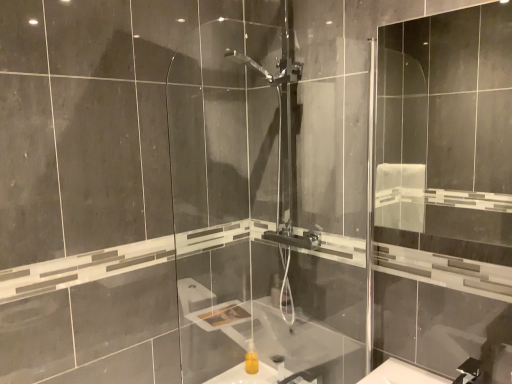
Question: Should I look upward or downward to see transparent glass shower door at center, the 1th screen door from the left?

Choices:
 (A) up
 (B) down

Answer: (B)

Question: Does transparent glass shower door at center, the 1th screen door from the left, have a lesser height compared to transparent glass screen door at right, positioned as the second screen door in left-to-right order?

Choices:
 (A) no
 (B) yes

Answer: (A)

Question: Is transparent glass shower door at center, which is the 2th screen door in right-to-left order, touching transparent glass screen door at right, the first screen door positioned from the right?

Choices:
 (A) yes
 (B) no

Answer: (B)

Question: From the image's perspective, is transparent glass shower door at center, which is the 2th screen door in right-to-left order, under transparent glass screen door at right, positioned as the second screen door in left-to-right order?

Choices:
 (A) yes
 (B) no

Answer: (A)

Question: Is transparent glass shower door at center, the 1th screen door from the left, wider than transparent glass screen door at right, positioned as the second screen door in left-to-right order?

Choices:
 (A) no
 (B) yes

Answer: (A)

Question: Can you confirm if transparent glass shower door at center, the 1th screen door from the left, is bigger than transparent glass screen door at right, positioned as the second screen door in left-to-right order?

Choices:
 (A) no
 (B) yes

Answer: (B)

Question: Is transparent glass screen door at right, positioned as the second screen door in left-to-right order, surrounded by transparent glass shower door at center, which is the 2th screen door in right-to-left order?

Choices:
 (A) no
 (B) yes

Answer: (A)

Question: Can you confirm if transparent glass screen door at right, the first screen door positioned from the right, is taller than yellow matte sink at center?

Choices:
 (A) yes
 (B) no

Answer: (A)

Question: Is transparent glass screen door at right, positioned as the second screen door in left-to-right order, to the right of yellow matte sink at center from the viewer's perspective?

Choices:
 (A) no
 (B) yes

Answer: (B)

Question: Considering the relative sizes of transparent glass screen door at right, the first screen door positioned from the right, and yellow matte sink at center in the image provided, is transparent glass screen door at right, the first screen door positioned from the right, smaller than yellow matte sink at center?

Choices:
 (A) no
 (B) yes

Answer: (A)

Question: From a real-world perspective, does transparent glass screen door at right, the first screen door positioned from the right, sit lower than yellow matte sink at center?

Choices:
 (A) no
 (B) yes

Answer: (A)

Question: Is transparent glass screen door at right, the first screen door positioned from the right, to the left of yellow matte sink at center from the viewer's perspective?

Choices:
 (A) yes
 (B) no

Answer: (B)

Question: Are transparent glass screen door at right, the first screen door positioned from the right, and yellow matte sink at center beside each other?

Choices:
 (A) no
 (B) yes

Answer: (A)

Question: From a real-world perspective, does yellow matte sink at center sit lower than transparent glass screen door at right, the first screen door positioned from the right?

Choices:
 (A) no
 (B) yes

Answer: (B)